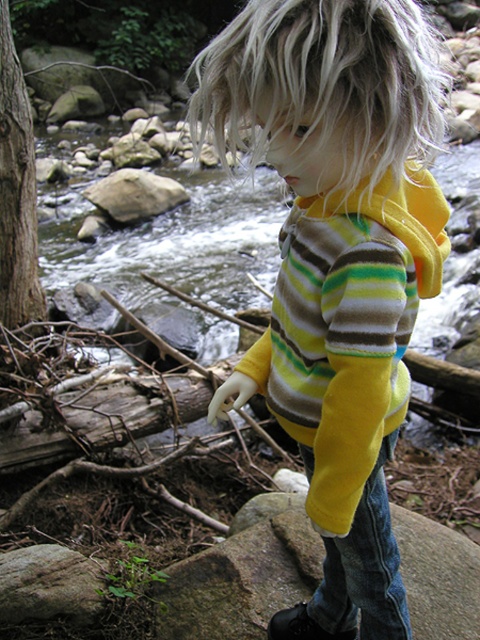
Question: Which of the following is the farthest from the observer?

Choices:
 (A) (394, 637)
 (B) (381, 172)
 (C) (111, 188)
 (D) (387, 116)

Answer: (C)

Question: Is yellow fleece hoodie at center to the left of blondehair at center from the viewer's perspective?

Choices:
 (A) yes
 (B) no

Answer: (B)

Question: Which of these objects is positioned farthest from the jeans at lower center?

Choices:
 (A) blondehair at center
 (B) yellow fleece hoodie at center

Answer: (A)

Question: Can you confirm if jeans at lower center is positioned below smooth gray rock at center?

Choices:
 (A) yes
 (B) no

Answer: (A)

Question: Which of these objects is positioned closest to the smooth gray rock at center?

Choices:
 (A) jeans at lower center
 (B) blondehair at center
 (C) yellow fleece hoodie at center

Answer: (B)

Question: Does yellow fleece hoodie at center appear under blondehair at center?

Choices:
 (A) yes
 (B) no

Answer: (A)